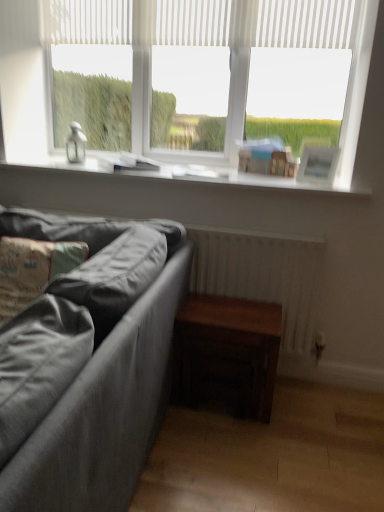
Question: Can you confirm if white smooth window sill at upper center is wider than textured gray fabric couch at lower left?

Choices:
 (A) yes
 (B) no

Answer: (B)

Question: Considering the relative sizes of white smooth window sill at upper center and textured gray fabric couch at lower left in the image provided, is white smooth window sill at upper center shorter than textured gray fabric couch at lower left?

Choices:
 (A) yes
 (B) no

Answer: (A)

Question: Considering the relative positions of white smooth window sill at upper center and textured gray fabric couch at lower left in the image provided, is white smooth window sill at upper center to the right of textured gray fabric couch at lower left from the viewer's perspective?

Choices:
 (A) yes
 (B) no

Answer: (A)

Question: From a real-world perspective, is white smooth window sill at upper center over textured gray fabric couch at lower left?

Choices:
 (A) yes
 (B) no

Answer: (A)

Question: Considering the relative sizes of white smooth window sill at upper center and textured gray fabric couch at lower left in the image provided, is white smooth window sill at upper center thinner than textured gray fabric couch at lower left?

Choices:
 (A) no
 (B) yes

Answer: (B)

Question: Does point (352, 193) appear closer or farther from the camera than point (132, 473)?

Choices:
 (A) farther
 (B) closer

Answer: (A)

Question: Considering the relative positions of white smooth window sill at upper center and textured gray fabric couch at lower left in the image provided, is white smooth window sill at upper center to the left or to the right of textured gray fabric couch at lower left?

Choices:
 (A) left
 (B) right

Answer: (B)

Question: Is white smooth window sill at upper center inside the boundaries of textured gray fabric couch at lower left, or outside?

Choices:
 (A) inside
 (B) outside

Answer: (B)

Question: Considering the positions of white smooth window sill at upper center and textured gray fabric couch at lower left in the image, is white smooth window sill at upper center bigger or smaller than textured gray fabric couch at lower left?

Choices:
 (A) small
 (B) big

Answer: (A)

Question: Is textured gray pillow at lower left wider or thinner than white matte window at upper center?

Choices:
 (A) wide
 (B) thin

Answer: (A)

Question: Is textured gray pillow at lower left spatially inside white matte window at upper center, or outside of it?

Choices:
 (A) inside
 (B) outside

Answer: (B)

Question: From a real-world perspective, is textured gray pillow at lower left physically located above or below white matte window at upper center?

Choices:
 (A) above
 (B) below

Answer: (B)

Question: Does point (76, 261) appear closer or farther from the camera than point (142, 27)?

Choices:
 (A) closer
 (B) farther

Answer: (A)

Question: Considering the positions of textured gray fabric couch at lower left and white matte window at upper center in the image, is textured gray fabric couch at lower left taller or shorter than white matte window at upper center?

Choices:
 (A) short
 (B) tall

Answer: (A)

Question: In the image, is textured gray fabric couch at lower left positioned in front of or behind white matte window at upper center?

Choices:
 (A) front
 (B) behind

Answer: (A)